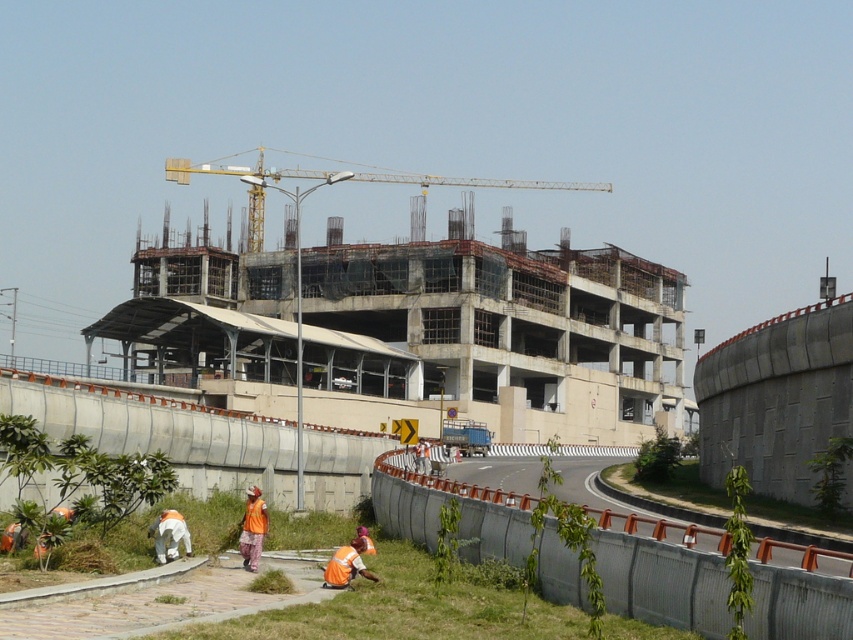
Question: Is orange fabric worker at lower center positioned at the back of white fabric at lower left?

Choices:
 (A) yes
 (B) no

Answer: (B)

Question: Which point is farther from the camera taking this photo?

Choices:
 (A) (332, 577)
 (B) (283, 168)

Answer: (B)

Question: Which point is farther from the camera taking this photo?

Choices:
 (A) (515, 182)
 (B) (254, 552)

Answer: (A)

Question: Is orange fabric worker at lower center further to the viewer compared to white fabric at lower left?

Choices:
 (A) yes
 (B) no

Answer: (B)

Question: Considering the relative positions of orange fabric worker at lower center and white fabric at lower left in the image provided, where is orange fabric worker at lower center located with respect to white fabric at lower left?

Choices:
 (A) left
 (B) right

Answer: (B)

Question: Among these objects, which one is nearest to the camera?

Choices:
 (A) white fabric at lower left
 (B) orange fabric worker at lower center
 (C) orange fabric at lower center

Answer: (B)